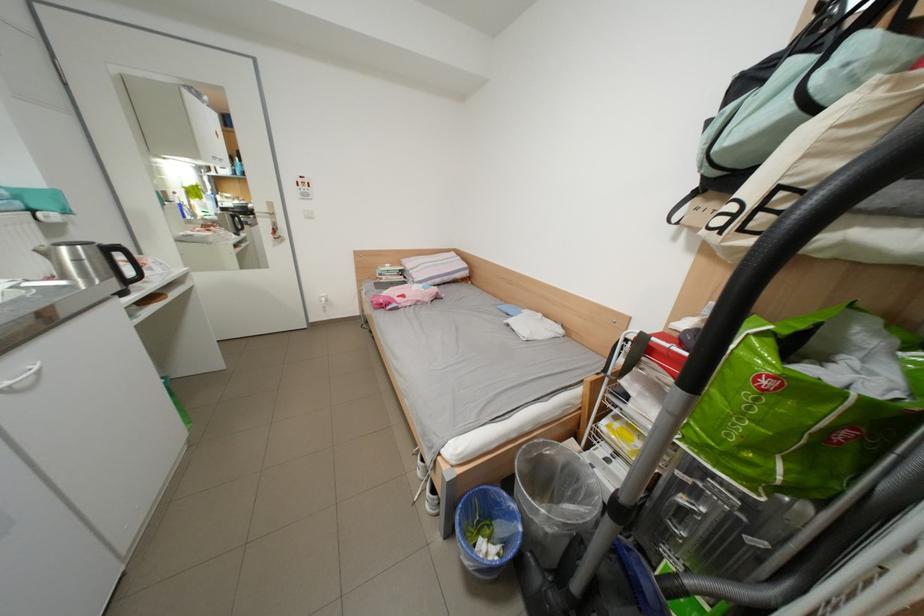
Where would you pull the black vacuum handle? Please return your answer as a coordinate pair (x, y).

(846, 188)